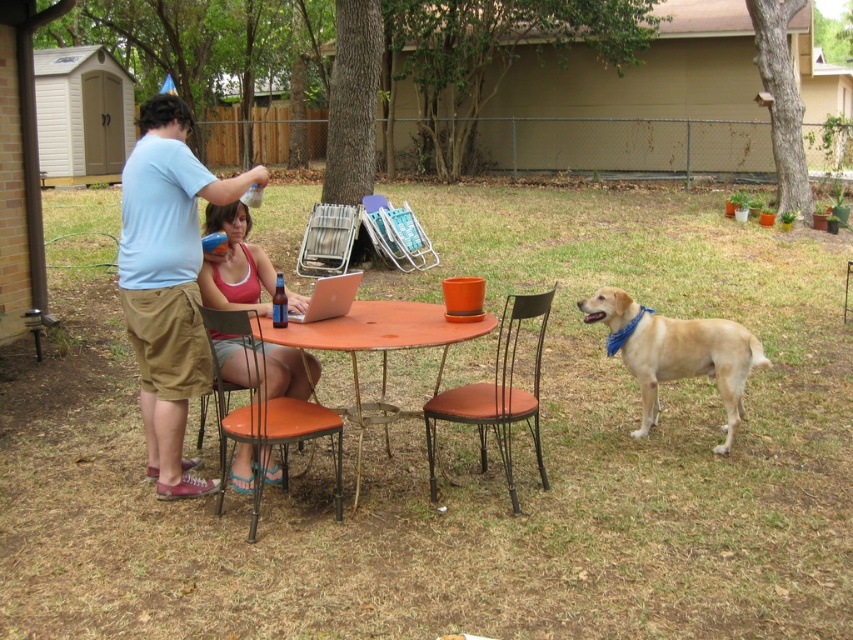
Question: Which object appears closest to the camera in this image?

Choices:
 (A) matte orange chair at center
 (B) golden fur dog at right

Answer: (A)

Question: Which is nearer to the orange matte table at center?

Choices:
 (A) metallic silver chair at center
 (B) orange leather chair at lower center

Answer: (B)

Question: Can you confirm if light blue t-shirt at left is thinner than orange matte table at center?

Choices:
 (A) yes
 (B) no

Answer: (A)

Question: Is light blue t-shirt at left further to the viewer compared to matte orange chair at center?

Choices:
 (A) yes
 (B) no

Answer: (A)

Question: Is orange matte table at center to the right of metallic silver folding chair at center from the viewer's perspective?

Choices:
 (A) no
 (B) yes

Answer: (B)

Question: Among these objects, which one is nearest to the camera?

Choices:
 (A) orange matte table at center
 (B) light blue t-shirt at left

Answer: (A)